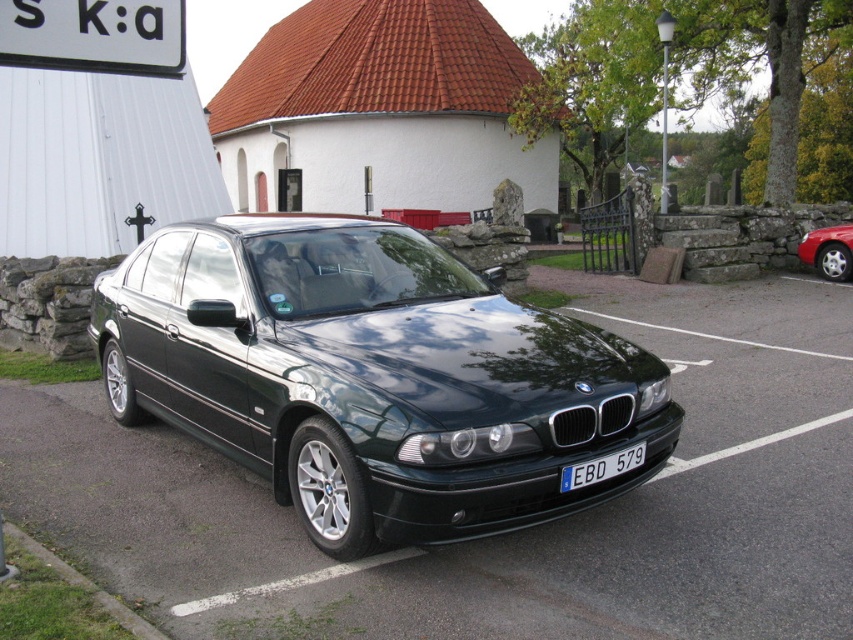
Question: Which point appears farthest from the camera in this image?

Choices:
 (A) (570, 465)
 (B) (654, 428)
 (C) (6, 58)
 (D) (801, 253)

Answer: (D)

Question: Considering the relative positions of shiny dark green car at center and blue metallic license plate at center in the image provided, where is shiny dark green car at center located with respect to blue metallic license plate at center?

Choices:
 (A) below
 (B) above

Answer: (B)

Question: Can you confirm if shiny dark green car at center is wider than metallic red car at right?

Choices:
 (A) yes
 (B) no

Answer: (A)

Question: Which of the following is the farthest from the observer?

Choices:
 (A) shiny dark green car at center
 (B) blue metallic license plate at center
 (C) metallic red car at right
 (D) white plastic sign at upper left

Answer: (C)

Question: Does white plastic sign at upper left appear on the left side of metallic red car at right?

Choices:
 (A) no
 (B) yes

Answer: (B)

Question: Estimate the real-world distances between objects in this image. Which object is closer to the shiny dark green car at center?

Choices:
 (A) white plastic sign at upper left
 (B) metallic red car at right
 (C) blue metallic license plate at center

Answer: (C)